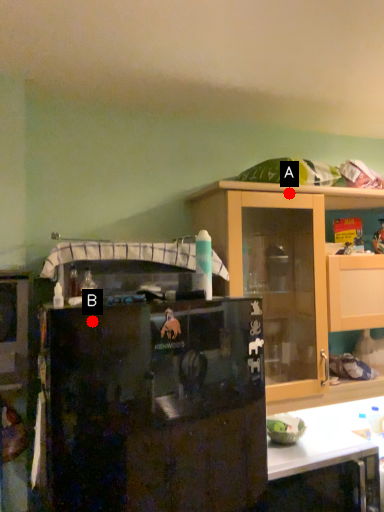
Question: Two points are circled on the image, labeled by A and B beside each circle. Which point is closer to the camera?

Choices:
 (A) A is closer
 (B) B is closer

Answer: (B)